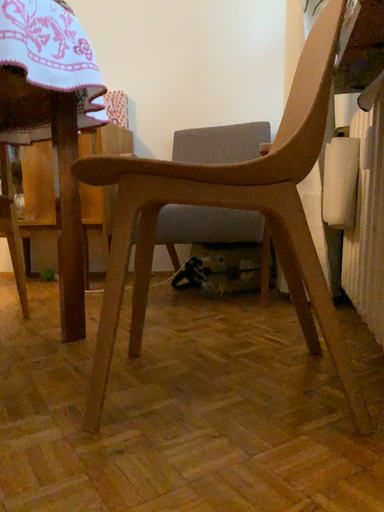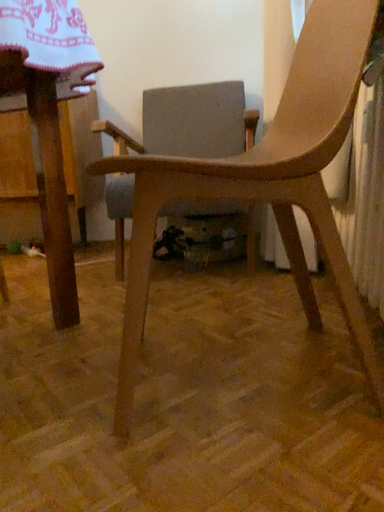
Question: How did the camera likely rotate when shooting the video?

Choices:
 (A) rotated upward
 (B) rotated downward

Answer: (B)